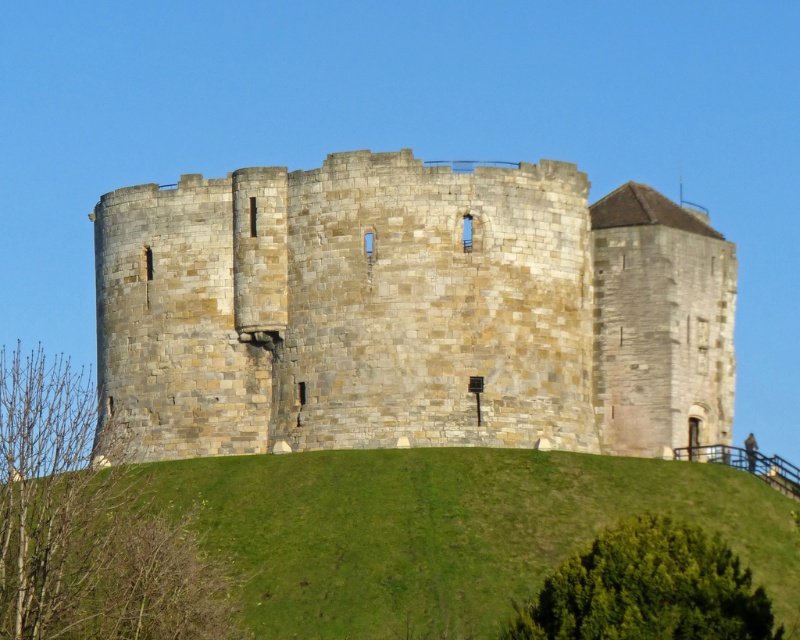
Is stone tower at center thinner than green grassy hill at center?

Incorrect, stone tower at center's width is not less than green grassy hill at center's.

Does stone tower at center appear over green grassy hill at center?

Correct, stone tower at center is located above green grassy hill at center.

Find the location of a particular element. stone tower at center is located at coordinates click(410, 310).